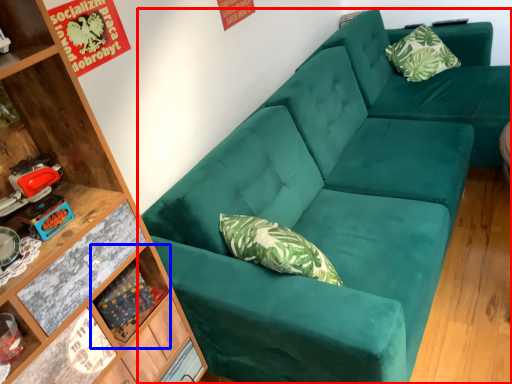
Question: Which point is closer to the camera, studio couch (highlighted by a red box) or shelf (highlighted by a blue box)?

Choices:
 (A) studio couch
 (B) shelf

Answer: (A)